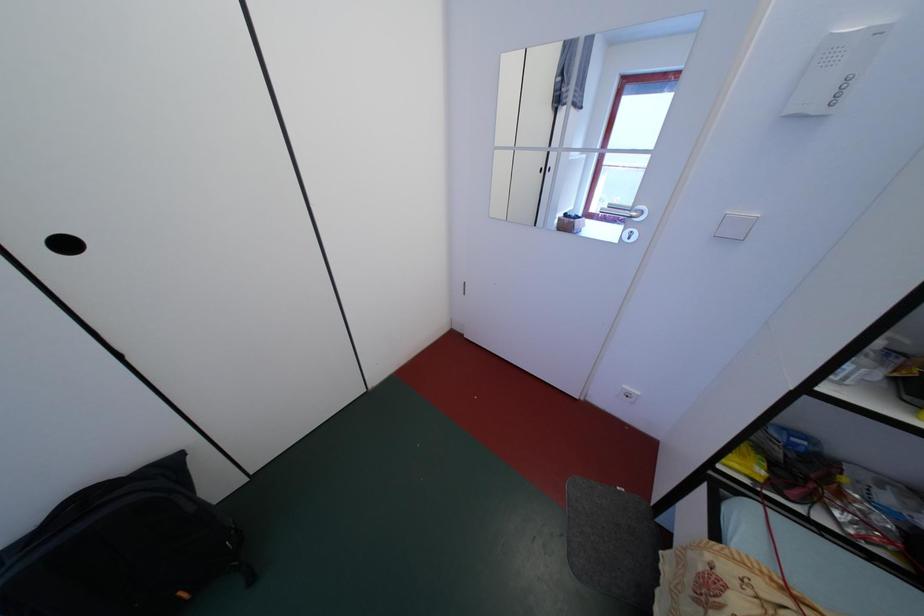
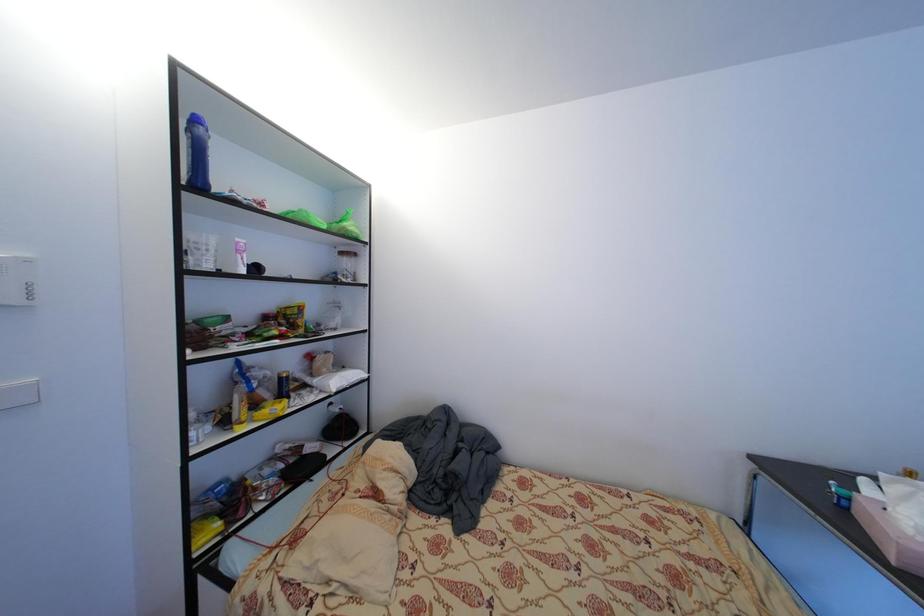
Question: The camera is either moving clockwise (left) or counter-clockwise (right) around the object. The first image is from the beginning of the video and the second image is from the end. Is the camera moving left or right when shooting the video?

Choices:
 (A) Left
 (B) Right

Answer: (A)